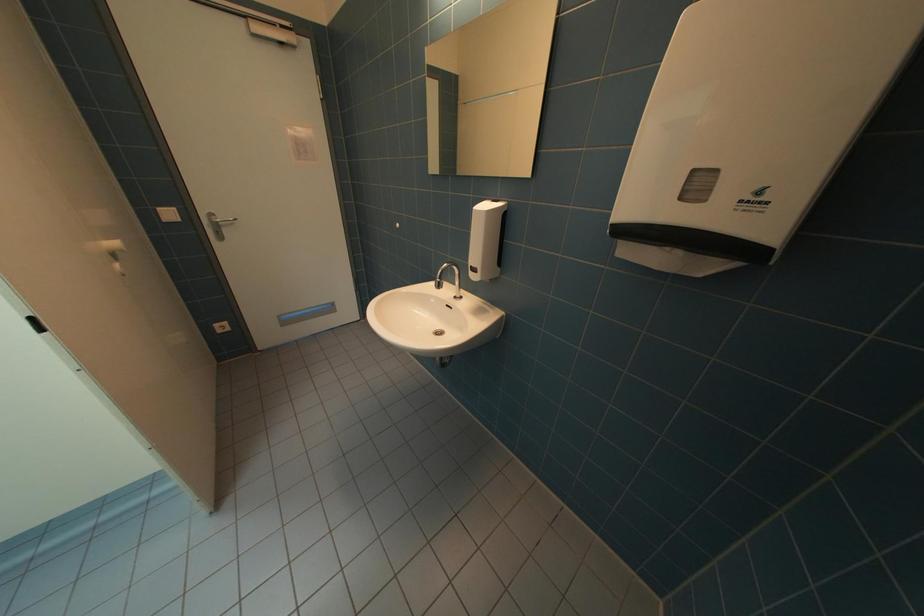
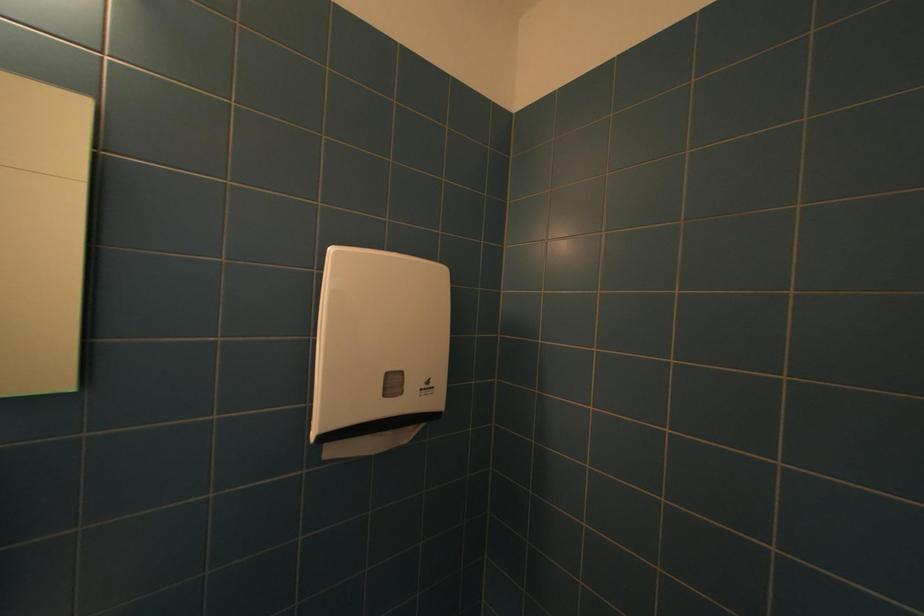
Question: The camera is either moving clockwise (left) or counter-clockwise (right) around the object. The first image is from the beginning of the video and the second image is from the end. Is the camera moving left or right when shooting the video?

Choices:
 (A) Left
 (B) Right

Answer: (A)